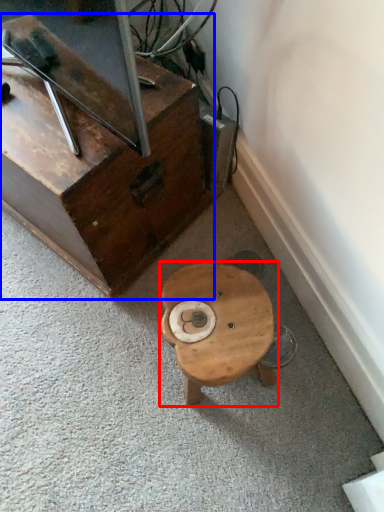
Question: Which object appears closest to the camera in this image, table (highlighted by a red box) or furniture (highlighted by a blue box)?

Choices:
 (A) table
 (B) furniture

Answer: (A)